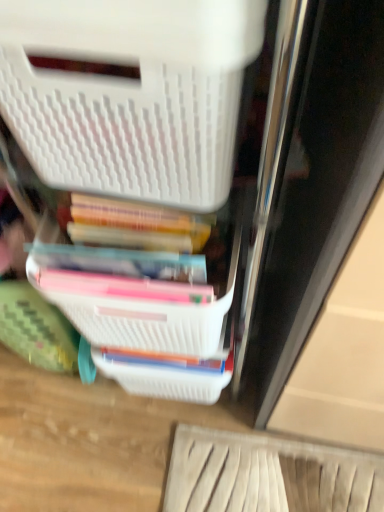
Question: Is white plastic basket at center not inside white plastic storage box at upper left?

Choices:
 (A) yes
 (B) no

Answer: (A)

Question: Is the position of white plastic basket at center more distant than that of white plastic storage box at upper left?

Choices:
 (A) no
 (B) yes

Answer: (B)

Question: Can you confirm if white plastic basket at center is shorter than white plastic storage box at upper left?

Choices:
 (A) no
 (B) yes

Answer: (B)

Question: Is white plastic storage box at upper left at the back of white plastic basket at center?

Choices:
 (A) yes
 (B) no

Answer: (B)

Question: Is white plastic basket at center to the right of white plastic storage box at upper left from the viewer's perspective?

Choices:
 (A) no
 (B) yes

Answer: (B)

Question: Is white plastic storage box at upper left located within white plastic basket at center?

Choices:
 (A) no
 (B) yes

Answer: (A)

Question: Is white plastic storage box at upper left shorter than white plastic basket at center?

Choices:
 (A) no
 (B) yes

Answer: (A)

Question: From a real-world perspective, is white plastic storage box at upper left under white plastic basket at center?

Choices:
 (A) no
 (B) yes

Answer: (A)

Question: Considering the relative positions of white plastic storage box at upper left and white plastic basket at center in the image provided, is white plastic storage box at upper left to the left of white plastic basket at center from the viewer's perspective?

Choices:
 (A) yes
 (B) no

Answer: (A)

Question: Would you say white plastic storage box at upper left contains white plastic basket at center?

Choices:
 (A) no
 (B) yes

Answer: (A)

Question: Is white plastic storage box at upper left oriented towards white plastic basket at center?

Choices:
 (A) yes
 (B) no

Answer: (B)

Question: From the image's perspective, is white plastic storage box at upper left over white plastic basket at center?

Choices:
 (A) no
 (B) yes

Answer: (B)

Question: Considering the relative positions of white plastic storage box at upper left and white plastic basket at center in the image provided, is white plastic storage box at upper left to the left or to the right of white plastic basket at center?

Choices:
 (A) left
 (B) right

Answer: (A)